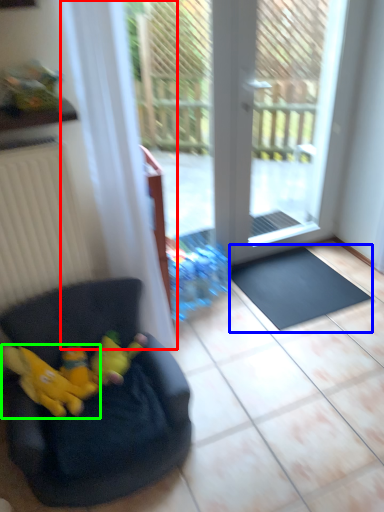
Question: Based on their relative distances, which object is farther from curtain (highlighted by a red box)? Choose from doormat (highlighted by a blue box) and animal (highlighted by a green box).

Choices:
 (A) doormat
 (B) animal

Answer: (A)